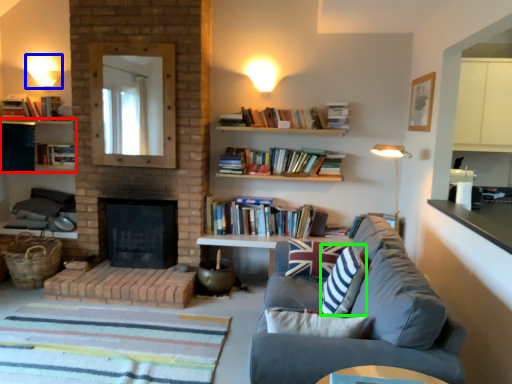
Question: Which is nearer to the shelf (highlighted by a red box)? lighting (highlighted by a blue box) or pillow (highlighted by a green box).

Choices:
 (A) lighting
 (B) pillow

Answer: (A)